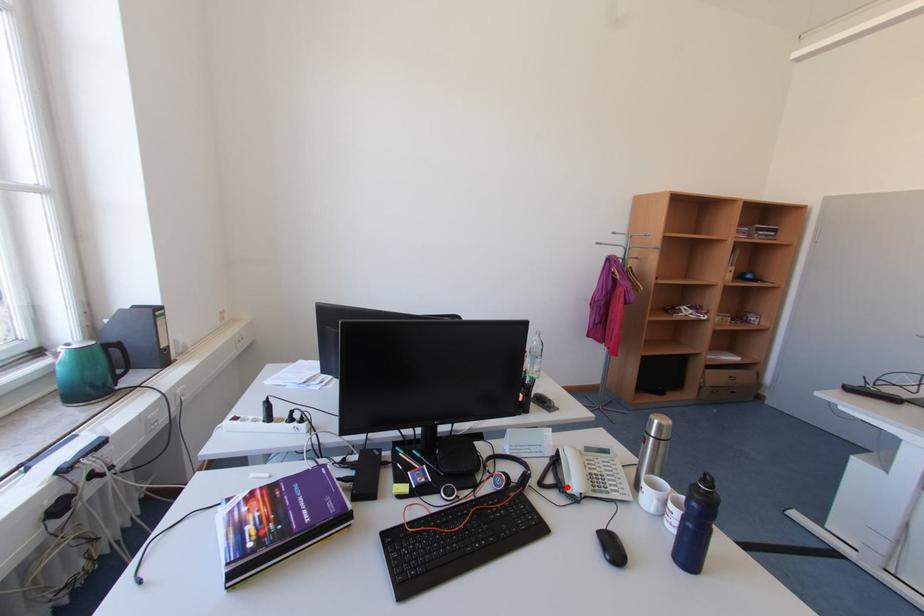
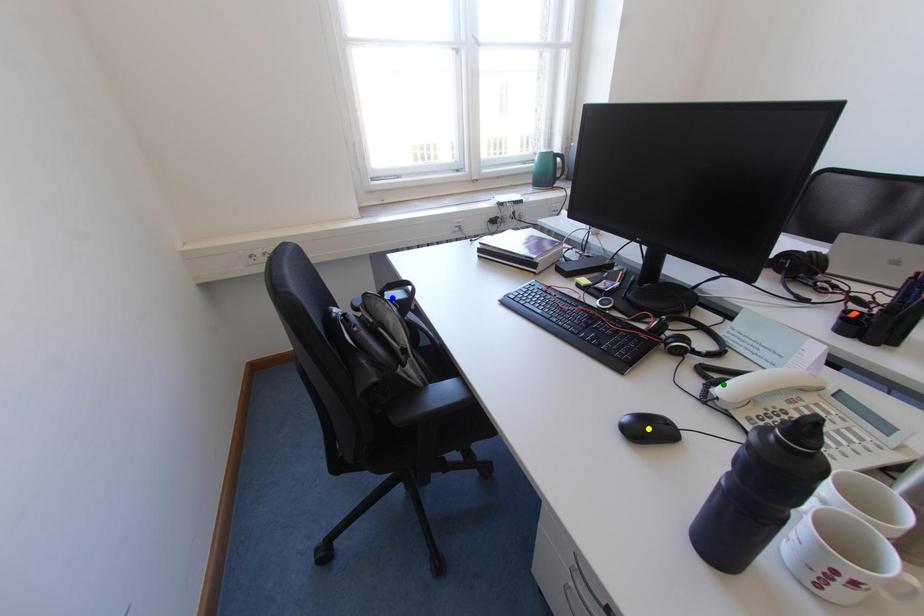
Question: I am providing you with two images of the same scene from different viewpoints. A red point is marked on the first image. You are given multiple points on the second image. Can you choose the point in image 2 that corresponds to the point in image 1?

Choices:
 (A) blue point
 (B) yellow point
 (C) green point

Answer: (C)